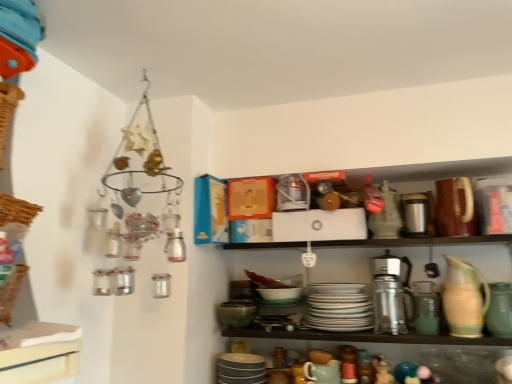
What do you see at coordinates (11, 292) in the screenshot? Image resolution: width=512 pixels, height=384 pixels. I see `woven brown basket at left` at bounding box center [11, 292].

Describe the element at coordinates (339, 307) in the screenshot. I see `white glossy plates at center, the third tableware positioned from the left` at that location.

At what (x,y) coordinates should I click in order to perform the action: click on matte ceramic mug at lower center, positioned as the second tableware in left-to-right order. Please return your answer as a coordinate pair (x, y). Looking at the image, I should click on (322, 372).

How much space does speckled ceramic pitcher at right, which is the 2th tableware in right-to-left order, occupy vertically?

speckled ceramic pitcher at right, which is the 2th tableware in right-to-left order, is 11.11 inches in height.

How much space does speckled ceramic pitcher at right, which is the 2th tableware in right-to-left order, occupy horizontally?

speckled ceramic pitcher at right, which is the 2th tableware in right-to-left order, is 3.07 inches in width.

What do you see at coordinates (240, 369) in the screenshot? I see `matte gray plates at lower center, the first tableware from the left` at bounding box center [240, 369].

Image resolution: width=512 pixels, height=384 pixels. I want to click on woven brown basket at left, so click(11, 292).

How different are the orientations of matte gray plates at lower center, the first tableware from the left, and white glossy plates at center, which is counted as the 3th tableware, starting from the right, in degrees?

There is a 0.000162-degree angle between the facing directions of matte gray plates at lower center, the first tableware from the left, and white glossy plates at center, which is counted as the 3th tableware, starting from the right.

Is matte gray plates at lower center, the first tableware from the left, looking in the opposite direction of white glossy plates at center, which is counted as the 3th tableware, starting from the right?

No, matte gray plates at lower center, the first tableware from the left, is not facing away from white glossy plates at center, which is counted as the 3th tableware, starting from the right.

Identify the location of tableware that is the 1st object located in front of the matte gray plates at lower center, the first tableware from the left. (339, 307).

Which of these two, matte gray plates at lower center, the 5th tableware from the right, or white glossy plates at center, the third tableware positioned from the left, stands taller?

Standing taller between the two is white glossy plates at center, the third tableware positioned from the left.

From the image's perspective, relative to green matte vase at right, the fifth tableware from the left, is speckled ceramic pitcher at right, which is the 2th tableware in right-to-left order, above or below?

From the image's perspective, speckled ceramic pitcher at right, which is the 2th tableware in right-to-left order, appears above green matte vase at right, the fifth tableware from the left.

Where is `the 1st tableware behind the green matte vase at right, the fifth tableware from the left`? This screenshot has height=384, width=512. the 1st tableware behind the green matte vase at right, the fifth tableware from the left is located at coordinates (464, 298).

Considering the relative positions of speckled ceramic pitcher at right, which is the fourth tableware from left to right, and green matte vase at right, which is the 1th tableware in right-to-left order, in the image provided, is speckled ceramic pitcher at right, which is the fourth tableware from left to right, behind green matte vase at right, which is the 1th tableware in right-to-left order,?

Yes, speckled ceramic pitcher at right, which is the fourth tableware from left to right, is behind green matte vase at right, which is the 1th tableware in right-to-left order.

Would you say speckled ceramic pitcher at right, which is the 2th tableware in right-to-left order, is to the left or to the right of green matte vase at right, which is the 1th tableware in right-to-left order, in the picture?

From the image, it's evident that speckled ceramic pitcher at right, which is the 2th tableware in right-to-left order, is to the left of green matte vase at right, which is the 1th tableware in right-to-left order.

From a real-world perspective, is speckled ceramic pitcher at right, which is the 2th tableware in right-to-left order, located higher than matte ceramic mug at lower center, the fourth tableware when ordered from right to left?

Correct, in the physical world, speckled ceramic pitcher at right, which is the 2th tableware in right-to-left order, is higher than matte ceramic mug at lower center, the fourth tableware when ordered from right to left.

The image size is (512, 384). What are the coordinates of `tableware that is the 3rd object located above the matte ceramic mug at lower center, the fourth tableware when ordered from right to left (from the image's perspective)` in the screenshot? It's located at (464, 298).

From the image's perspective, which is above, speckled ceramic pitcher at right, which is the 2th tableware in right-to-left order, or matte ceramic mug at lower center, positioned as the second tableware in left-to-right order?

From the image's view, speckled ceramic pitcher at right, which is the 2th tableware in right-to-left order, is above.

Is speckled ceramic pitcher at right, which is the 2th tableware in right-to-left order, aimed at matte ceramic mug at lower center, positioned as the second tableware in left-to-right order?

No, speckled ceramic pitcher at right, which is the 2th tableware in right-to-left order, is not aimed at matte ceramic mug at lower center, positioned as the second tableware in left-to-right order.

Would you consider matte ceramic mug at lower center, the fourth tableware when ordered from right to left, to be distant from matte gray plates at lower center, the 5th tableware from the right?

matte ceramic mug at lower center, the fourth tableware when ordered from right to left, is actually quite close to matte gray plates at lower center, the 5th tableware from the right.

From the image's perspective, is matte ceramic mug at lower center, positioned as the second tableware in left-to-right order, below matte gray plates at lower center, the first tableware from the left?

A: No, from the image's perspective, matte ceramic mug at lower center, positioned as the second tableware in left-to-right order, is not below matte gray plates at lower center, the first tableware from the left.

Consider the image. Considering the relative sizes of matte ceramic mug at lower center, the fourth tableware when ordered from right to left, and matte gray plates at lower center, the 5th tableware from the right, in the image provided, is matte ceramic mug at lower center, the fourth tableware when ordered from right to left, shorter than matte gray plates at lower center, the 5th tableware from the right,?

Indeed, matte ceramic mug at lower center, the fourth tableware when ordered from right to left, has a lesser height compared to matte gray plates at lower center, the 5th tableware from the right.

Is green matte vase at right, the fifth tableware from the left, shorter than metallic silver thermos at lower right?

Correct, green matte vase at right, the fifth tableware from the left, is not as tall as metallic silver thermos at lower right.

Is green matte vase at right, which is the 1th tableware in right-to-left order, with metallic silver thermos at lower right?

green matte vase at right, which is the 1th tableware in right-to-left order, and metallic silver thermos at lower right are not in contact.

Can you tell me how much green matte vase at right, the fifth tableware from the left, and metallic silver thermos at lower right differ in facing direction?

The angular difference between green matte vase at right, the fifth tableware from the left, and metallic silver thermos at lower right is 0.000392 degrees.

From the image's perspective, is green matte vase at right, which is the 1th tableware in right-to-left order, on top of metallic silver thermos at lower right?

Yes.

Is woven brown basket at left located outside green matte vase at right, which is the 1th tableware in right-to-left order?

That's correct, woven brown basket at left is outside of green matte vase at right, which is the 1th tableware in right-to-left order.

Between woven brown basket at left and green matte vase at right, the fifth tableware from the left, which one appears on the right side from the viewer's perspective?

green matte vase at right, the fifth tableware from the left, is more to the right.

Which is nearer, (16, 276) or (497, 290)?

Point (16, 276) is positioned closer to the camera compared to point (497, 290).

From a real-world perspective, is green matte vase at right, which is the 1th tableware in right-to-left order, physically located above or below white glossy plates at center, the third tableware positioned from the left?

From a real-world perspective, green matte vase at right, which is the 1th tableware in right-to-left order, is physically below white glossy plates at center, the third tableware positioned from the left.

Who is more distant, green matte vase at right, the fifth tableware from the left, or white glossy plates at center, which is counted as the 3th tableware, starting from the right?

white glossy plates at center, which is counted as the 3th tableware, starting from the right, is further away from the camera.

Is green matte vase at right, the fifth tableware from the left, facing towards white glossy plates at center, the third tableware positioned from the left?

No, green matte vase at right, the fifth tableware from the left, does not turn towards white glossy plates at center, the third tableware positioned from the left.

Where is `the 2nd tableware to the left of the white glossy plates at center, which is counted as the 3th tableware, starting from the right, counting from the anchor's position`? The width and height of the screenshot is (512, 384). the 2nd tableware to the left of the white glossy plates at center, which is counted as the 3th tableware, starting from the right, counting from the anchor's position is located at coordinates (240, 369).

Where is `tableware on the right of speckled ceramic pitcher at right, which is the 2th tableware in right-to-left order`? This screenshot has height=384, width=512. tableware on the right of speckled ceramic pitcher at right, which is the 2th tableware in right-to-left order is located at coordinates (500, 310).

Based on their spatial positions, is metallic silver thermos at lower right or white glossy plates at center, which is counted as the 3th tableware, starting from the right, closer to woven brown basket at left?

white glossy plates at center, which is counted as the 3th tableware, starting from the right, is positioned closer to the anchor woven brown basket at left.

Based on their spatial positions, is white glossy plates at center, which is counted as the 3th tableware, starting from the right, or matte gray plates at lower center, the 5th tableware from the right, closer to speckled ceramic pitcher at right, which is the 2th tableware in right-to-left order?

Based on the image, white glossy plates at center, which is counted as the 3th tableware, starting from the right, appears to be nearer to speckled ceramic pitcher at right, which is the 2th tableware in right-to-left order.

Estimate the real-world distances between objects in this image. Which object is further from green matte vase at right, the fifth tableware from the left, matte gray plates at lower center, the 5th tableware from the right, or matte ceramic mug at lower center, the fourth tableware when ordered from right to left?

The object further to green matte vase at right, the fifth tableware from the left, is matte gray plates at lower center, the 5th tableware from the right.

When comparing their distances from speckled ceramic pitcher at right, which is the 2th tableware in right-to-left order, does matte ceramic mug at lower center, positioned as the second tableware in left-to-right order, or woven brown basket at left seem further?

woven brown basket at left is further to speckled ceramic pitcher at right, which is the 2th tableware in right-to-left order.

Which object lies further to the anchor point matte ceramic mug at lower center, positioned as the second tableware in left-to-right order, matte gray plates at lower center, the 5th tableware from the right, or green matte vase at right, the fifth tableware from the left?

green matte vase at right, the fifth tableware from the left, is positioned further to the anchor matte ceramic mug at lower center, positioned as the second tableware in left-to-right order.

Considering their positions, is woven brown basket at left positioned closer to white glossy plates at center, which is counted as the 3th tableware, starting from the right, than matte ceramic mug at lower center, the fourth tableware when ordered from right to left?

matte ceramic mug at lower center, the fourth tableware when ordered from right to left, is closer to white glossy plates at center, which is counted as the 3th tableware, starting from the right.

Based on their spatial positions, is green matte vase at right, the fifth tableware from the left, or matte gray plates at lower center, the first tableware from the left, further from white glossy plates at center, which is counted as the 3th tableware, starting from the right?

green matte vase at right, the fifth tableware from the left, lies further to white glossy plates at center, which is counted as the 3th tableware, starting from the right, than the other object.

Which object lies nearer to the anchor point white glossy plates at center, the third tableware positioned from the left, speckled ceramic pitcher at right, which is the fourth tableware from left to right, or green matte vase at right, the fifth tableware from the left?

speckled ceramic pitcher at right, which is the fourth tableware from left to right, lies closer to white glossy plates at center, the third tableware positioned from the left, than the other object.

Identify the location of pottery between matte ceramic mug at lower center, the fourth tableware when ordered from right to left, and green matte vase at right, which is the 1th tableware in right-to-left order. (390, 305).

Find the location of `tableware between metallic silver thermos at lower right and matte ceramic mug at lower center, the fourth tableware when ordered from right to left, vertically`. tableware between metallic silver thermos at lower right and matte ceramic mug at lower center, the fourth tableware when ordered from right to left, vertically is located at coordinates (339, 307).

The height and width of the screenshot is (384, 512). Find the location of `pottery between matte gray plates at lower center, the first tableware from the left, and green matte vase at right, which is the 1th tableware in right-to-left order`. pottery between matte gray plates at lower center, the first tableware from the left, and green matte vase at right, which is the 1th tableware in right-to-left order is located at coordinates (390, 305).

In order to click on pottery located between white glossy plates at center, the third tableware positioned from the left, and speckled ceramic pitcher at right, which is the 2th tableware in right-to-left order, in the left-right direction in this screenshot , I will do `click(390, 305)`.